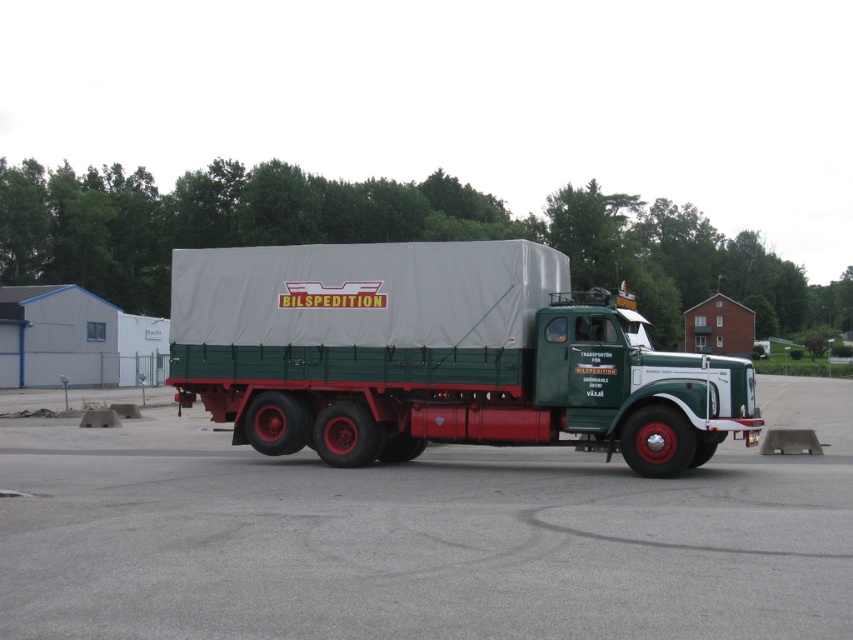
Consider the image. You are a delivery driver who needs to park your truck in a tight space. The parking area has a gray asphalt parking lot at center and a green matte truck at center. Can your truck, which is 4 meters long, fit into the available space between them?

The distance between the gray asphalt parking lot at center and the green matte truck at center is 3.99 meters, which is slightly less than the truck length of 4 meters. Therefore, the truck cannot fit into the available space between them.

You are a delivery driver who needs to park your green matte truck at center in the gray asphalt parking lot at center. Considering the size of the parking lot and the truck, will there be enough space to park without touching the surrounding vehicles?

The gray asphalt parking lot at center has a larger size compared to the green matte truck at center, so there should be enough space to park without touching the surrounding vehicles.